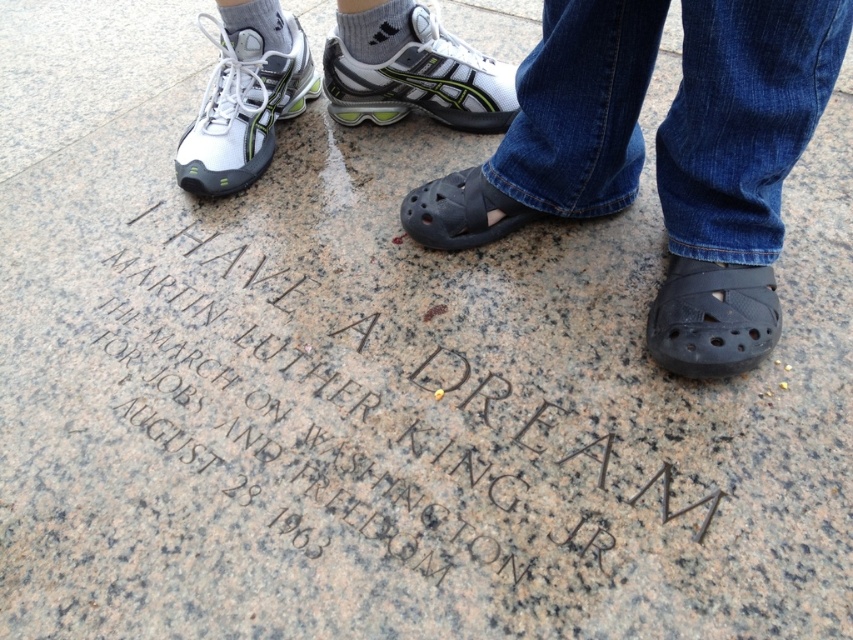
Is point (421, 72) farther from camera compared to point (383, 76)?

No, it is in front of (383, 76).

Is point (505, 122) positioned behind point (432, 92)?

Yes, it is behind point (432, 92).

This screenshot has width=853, height=640. Identify the location of white mesh sneakers at left. (421, 81).

Consider the image. Is granite engraving at center bigger than black rubber sandal at center?

Yes.

Can you confirm if granite engraving at center is thinner than black rubber sandal at center?

Incorrect, granite engraving at center's width is not less than black rubber sandal at center's.

Does point (624, 538) lie behind point (457, 236)?

No, (624, 538) is closer to viewer.

Where is `granite engraving at center`? The height and width of the screenshot is (640, 853). granite engraving at center is located at coordinates (427, 396).

Between white mesh sneakers at left and black rubber sandal at center, which one is positioned higher?

white mesh sneakers at left

From the picture: Does white mesh sneakers at left have a lesser width compared to black rubber sandal at center?

No, white mesh sneakers at left is not thinner than black rubber sandal at center.

Is point (239, 134) in front of point (415, 195)?

No, it is behind (415, 195).

Identify the location of white mesh sneakers at left. The height and width of the screenshot is (640, 853). (421, 81).